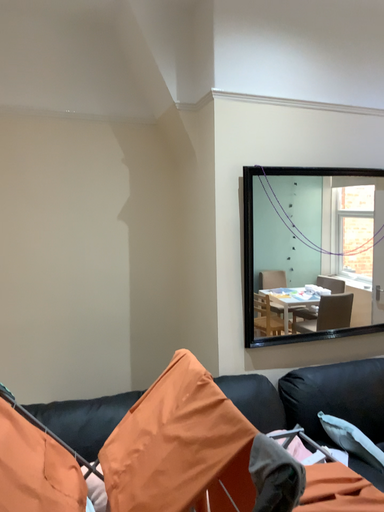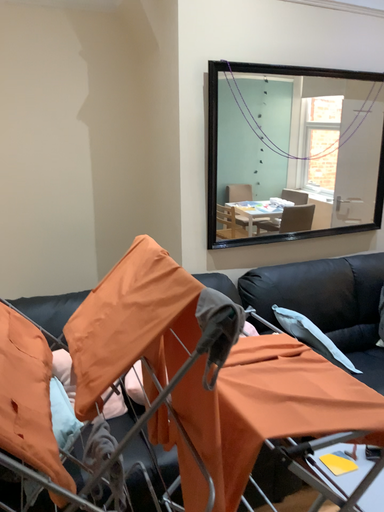
Question: How did the camera likely rotate when shooting the video?

Choices:
 (A) rotated downward
 (B) rotated upward

Answer: (A)